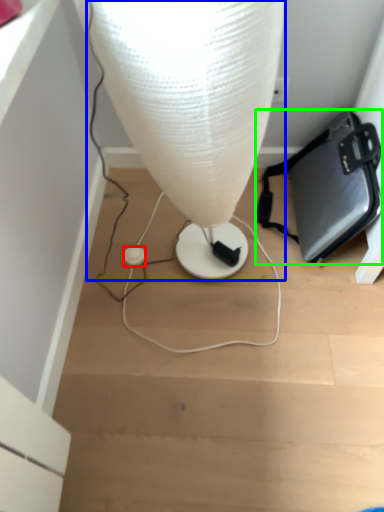
Question: Which object is positioned closest to earphone (highlighted by a red box)? Select from lamp (highlighted by a blue box) and handbag (highlighted by a green box).

Choices:
 (A) lamp
 (B) handbag

Answer: (A)